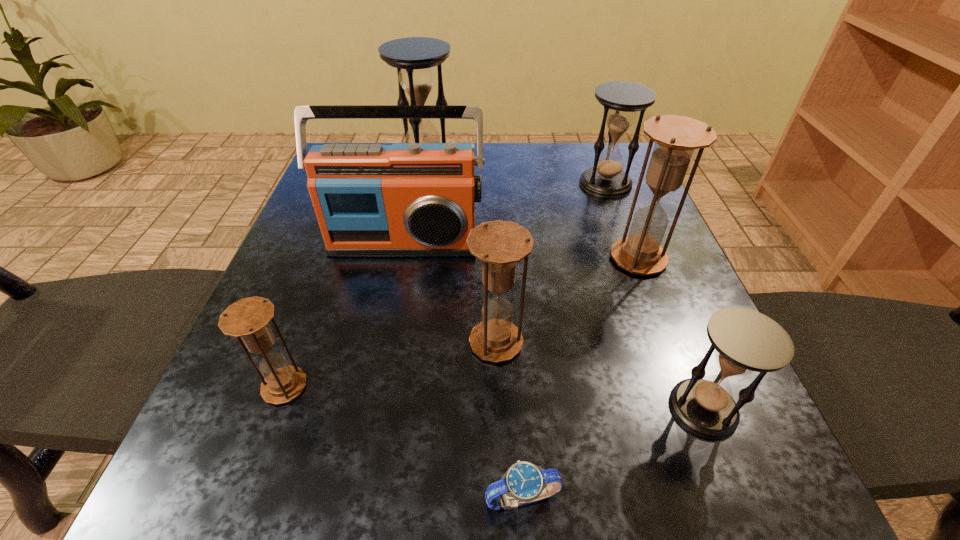
The height and width of the screenshot is (540, 960). I want to click on vacant area that lies between the nearest black hourglass and the leftmost hourglass, so click(494, 397).

Where is `vacant area that lies between the smallest brown hourglass and the fourth nearest hourglass`? vacant area that lies between the smallest brown hourglass and the fourth nearest hourglass is located at coordinates (462, 322).

Locate an element on the screen. free spot between the smallest black hourglass and the nearest brown hourglass is located at coordinates (494, 397).

You are a GUI agent. You are given a task and a screenshot of the screen. Output one action in this format:
    pyautogui.click(x=<x>, y=<y>)
    Task: Click on the vacant area between the second biggest black hourglass and the biggest brown hourglass
    The height and width of the screenshot is (540, 960).
    Given the screenshot: What is the action you would take?
    pyautogui.click(x=622, y=221)

I want to click on vacant region between the blue radio receiver and the second nearest brown hourglass, so click(x=450, y=292).

Locate an element on the screen. The height and width of the screenshot is (540, 960). unoccupied area between the smallest black hourglass and the nearest brown hourglass is located at coordinates (494, 397).

Locate an element on the screen. free area in between the nearest black hourglass and the blue radio receiver is located at coordinates (554, 326).

Locate an element on the screen. This screenshot has height=540, width=960. object that is the closest to the blue watch is located at coordinates (499, 244).

What are the coordinates of `object that is the fourth closest to the blue watch` in the screenshot? It's located at (676, 137).

Find the location of a particular element. The image size is (960, 540). the second closest hourglass to the nearest black hourglass is located at coordinates (676, 137).